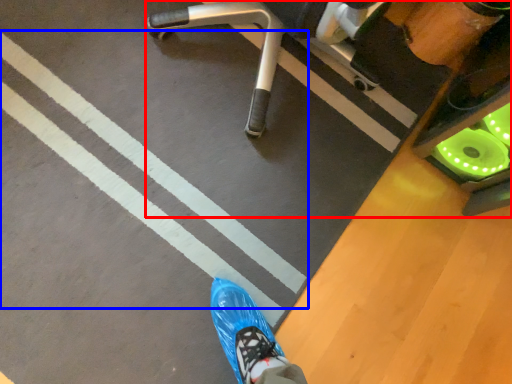
Question: Which object appears closest to the camera in this image, furniture (highlighted by a red box) or strip (highlighted by a blue box)?

Choices:
 (A) furniture
 (B) strip

Answer: (A)